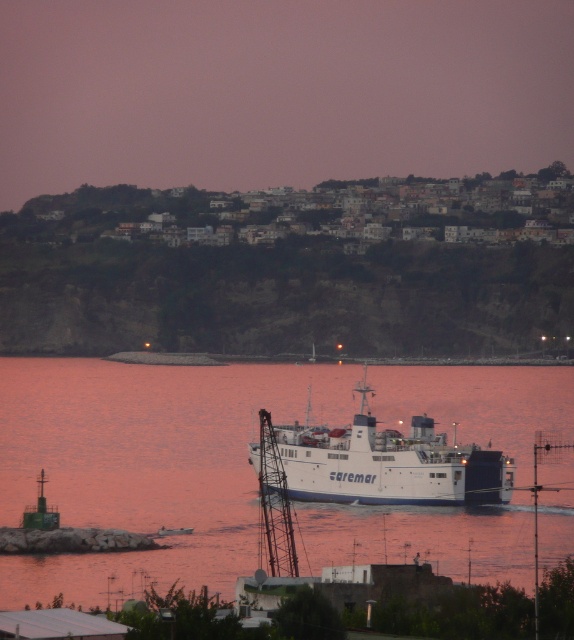
Question: Can you confirm if white matte water at center is positioned to the right of white matte ferry at center?

Choices:
 (A) no
 (B) yes

Answer: (A)

Question: Does white matte water at center have a smaller size compared to white matte ferry at center?

Choices:
 (A) no
 (B) yes

Answer: (A)

Question: Which of the following is the closest to the observer?

Choices:
 (A) (498, 532)
 (B) (421, 468)

Answer: (B)

Question: Which point is farther to the camera?

Choices:
 (A) white matte water at center
 (B) white matte ferry at center

Answer: (B)

Question: Is white matte water at center to the right of white matte ferry at center from the viewer's perspective?

Choices:
 (A) no
 (B) yes

Answer: (A)

Question: Which of the following is the farthest from the observer?

Choices:
 (A) (354, 499)
 (B) (83, 584)

Answer: (A)